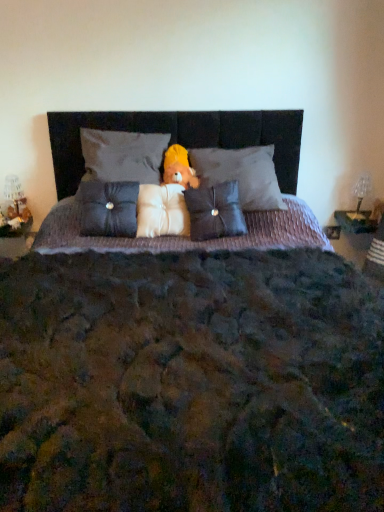
Question: Is the position of satin dark gray pillow at center, placed as the first pillow when sorted from left to right, less distant than that of white plush pillow at center, placed as the third pillow when sorted from right to left?

Choices:
 (A) no
 (B) yes

Answer: (B)

Question: Considering the relative sizes of satin dark gray pillow at center, placed as the first pillow when sorted from left to right, and white plush pillow at center, placed as the third pillow when sorted from left to right, in the image provided, is satin dark gray pillow at center, placed as the first pillow when sorted from left to right, wider than white plush pillow at center, placed as the third pillow when sorted from left to right,?

Choices:
 (A) no
 (B) yes

Answer: (A)

Question: Is satin dark gray pillow at center, placed as the first pillow when sorted from left to right, shorter than white plush pillow at center, placed as the third pillow when sorted from left to right?

Choices:
 (A) no
 (B) yes

Answer: (A)

Question: Would you say white plush pillow at center, placed as the third pillow when sorted from left to right, is part of satin dark gray pillow at center, marked as the 5th pillow in a right-to-left arrangement,'s contents?

Choices:
 (A) yes
 (B) no

Answer: (B)

Question: From the image's perspective, is satin dark gray pillow at center, marked as the 5th pillow in a right-to-left arrangement, below white plush pillow at center, placed as the third pillow when sorted from right to left?

Choices:
 (A) no
 (B) yes

Answer: (B)

Question: Would you say clear glass table lamp at right is inside or outside white plush pillow at center, placed as the third pillow when sorted from right to left?

Choices:
 (A) inside
 (B) outside

Answer: (B)

Question: In the image, is clear glass table lamp at right on the left side or the right side of white plush pillow at center, placed as the third pillow when sorted from right to left?

Choices:
 (A) right
 (B) left

Answer: (A)

Question: Based on their sizes in the image, would you say clear glass table lamp at right is bigger or smaller than white plush pillow at center, placed as the third pillow when sorted from left to right?

Choices:
 (A) small
 (B) big

Answer: (A)

Question: Is clear glass table lamp at right wider or thinner than white plush pillow at center, placed as the third pillow when sorted from left to right?

Choices:
 (A) thin
 (B) wide

Answer: (A)

Question: Is clear glass table lamp at right in front of or behind satin dark gray pillow at center, arranged as the 2th pillow when viewed from the right, in the image?

Choices:
 (A) behind
 (B) front

Answer: (A)

Question: Does point (355, 181) appear closer or farther from the camera than point (225, 223)?

Choices:
 (A) closer
 (B) farther

Answer: (B)

Question: Is clear glass table lamp at right wider or thinner than satin dark gray pillow at center, positioned as the fourth pillow in left-to-right order?

Choices:
 (A) thin
 (B) wide

Answer: (A)

Question: Considering the positions of clear glass table lamp at right and satin dark gray pillow at center, positioned as the fourth pillow in left-to-right order, in the image, is clear glass table lamp at right taller or shorter than satin dark gray pillow at center, positioned as the fourth pillow in left-to-right order,?

Choices:
 (A) short
 (B) tall

Answer: (A)

Question: Is white plush pillow at center, placed as the third pillow when sorted from left to right, in front of or behind clear glass table lamp at right in the image?

Choices:
 (A) front
 (B) behind

Answer: (A)

Question: From the image's perspective, is white plush pillow at center, placed as the third pillow when sorted from left to right, located above or below clear glass table lamp at right?

Choices:
 (A) below
 (B) above

Answer: (A)